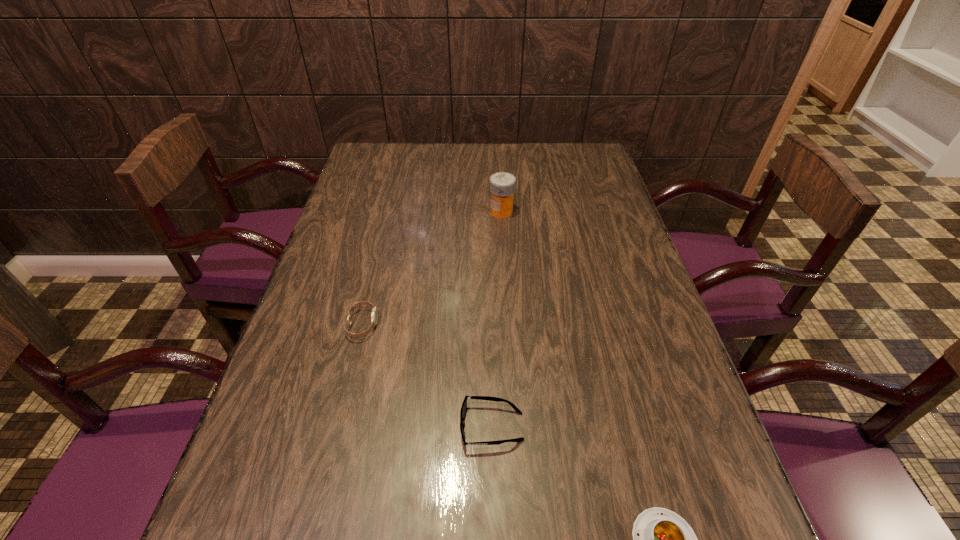
The height and width of the screenshot is (540, 960). In order to click on free space between the leftmost object and the sunglasses in this screenshot , I will do `click(427, 376)`.

The height and width of the screenshot is (540, 960). Find the location of `free spot between the farthest object and the leftmost object`. free spot between the farthest object and the leftmost object is located at coordinates (432, 268).

Choose which object is the third nearest neighbor to the second nearest object. Please provide its 2D coordinates. Your answer should be formatted as a tuple, i.e. [(x, y)], where the tuple contains the x and y coordinates of a point satisfying the conditions above.

[(502, 184)]

Identify the location of the third closest object to the watch. This screenshot has width=960, height=540. (662, 539).